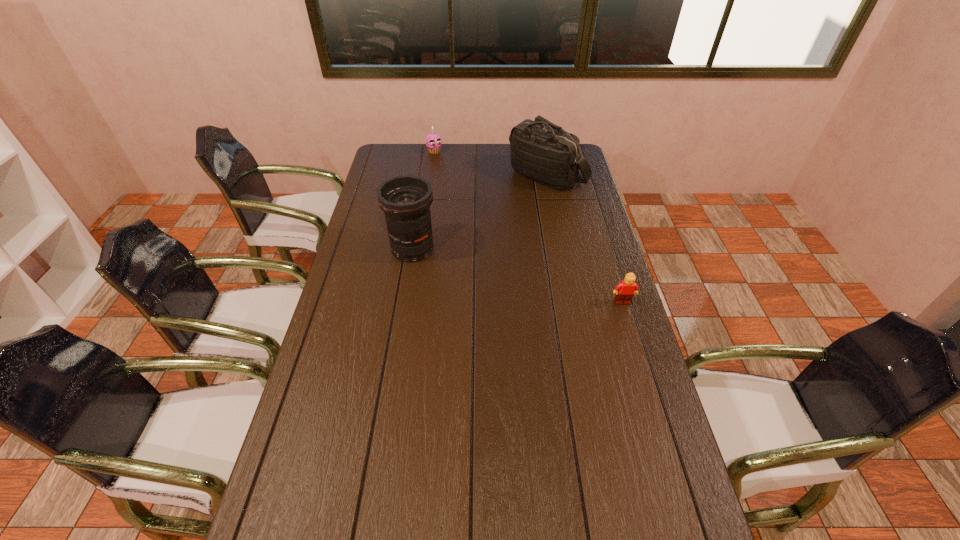
In the image, there is a desktop. Where is `vacant space at the right edge`? The height and width of the screenshot is (540, 960). vacant space at the right edge is located at coordinates (620, 342).

Locate an element on the screen. This screenshot has width=960, height=540. unoccupied area between the third farthest object and the shoulder bag is located at coordinates (480, 212).

Image resolution: width=960 pixels, height=540 pixels. Identify the location of vacant space that is in between the telephoto lens and the nearest object. (517, 275).

Identify the location of unoccupied area between the Lego and the shoulder bag. The height and width of the screenshot is (540, 960). (585, 239).

At what (x,y) coordinates should I click in order to perform the action: click on free space between the third nearest object and the Lego. Please return your answer as a coordinate pair (x, y). Image resolution: width=960 pixels, height=540 pixels. Looking at the image, I should click on (585, 239).

Where is `vacant area that lies between the second farthest object and the cupcake`? vacant area that lies between the second farthest object and the cupcake is located at coordinates (491, 164).

You are a GUI agent. You are given a task and a screenshot of the screen. Output one action in this format:
    pyautogui.click(x=<x>, y=<y>)
    Task: Click on the free area in between the shoulder bag and the telephoto lens
    The image size is (960, 540).
    Given the screenshot: What is the action you would take?
    pyautogui.click(x=480, y=212)

I want to click on free space that is in between the farthest object and the Lego, so click(528, 227).

Identify the location of the third closest object to the cupcake. This screenshot has height=540, width=960. (625, 290).

The width and height of the screenshot is (960, 540). I want to click on object that ranks as the third closest to the farthest object, so click(625, 290).